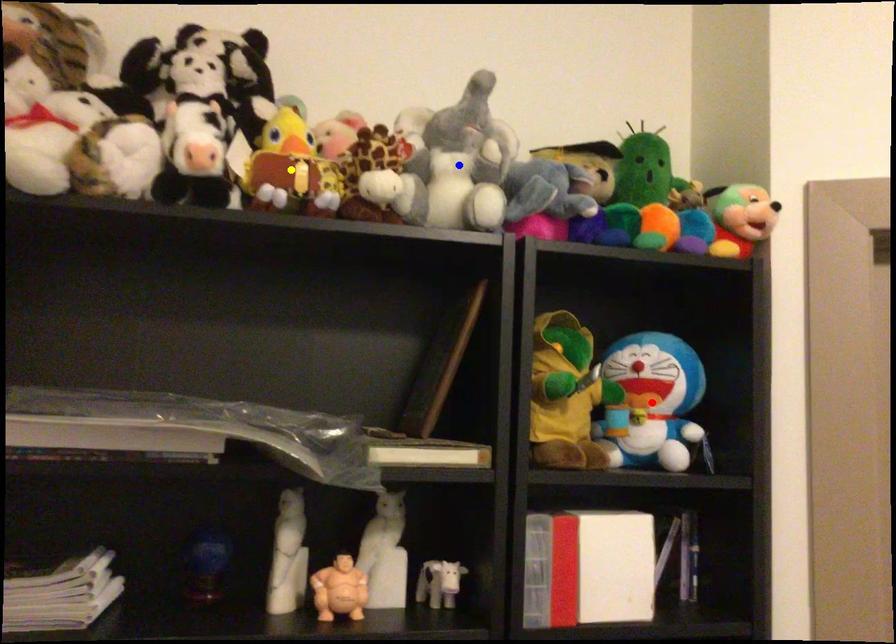
Order these from nearest to farthest:
A) blue point
B) red point
C) yellow point

red point
blue point
yellow point